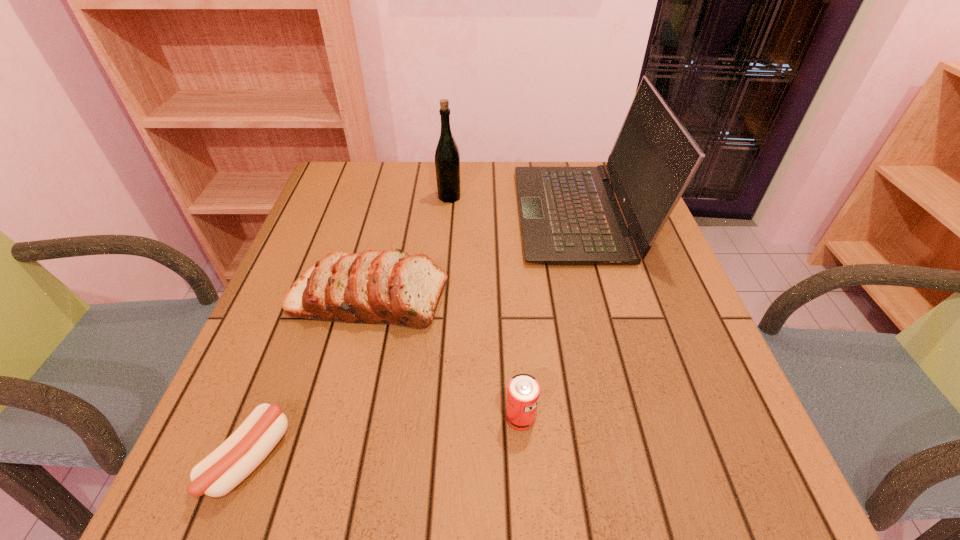
Find the location of a particular element. vacant region that satisfies the following two spatial constraints: 1. on the screen of the laptop computer; 2. on the front side of the bread is located at coordinates (603, 298).

Image resolution: width=960 pixels, height=540 pixels. I want to click on vacant space that satisfies the following two spatial constraints: 1. on the screen of the rightmost object; 2. on the front side of the second object from right to left, so pyautogui.click(x=636, y=417).